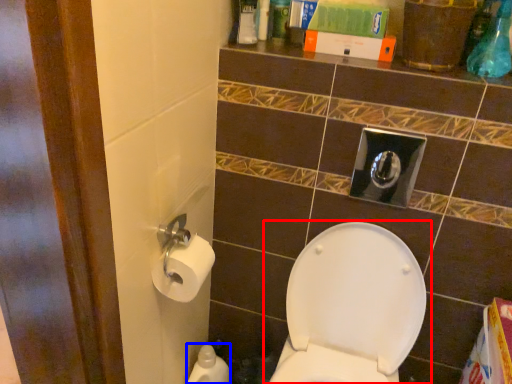
Question: Which object is further to the camera taking this photo, toilet (highlighted by a red box) or cleaning product (highlighted by a blue box)?

Choices:
 (A) toilet
 (B) cleaning product

Answer: (B)